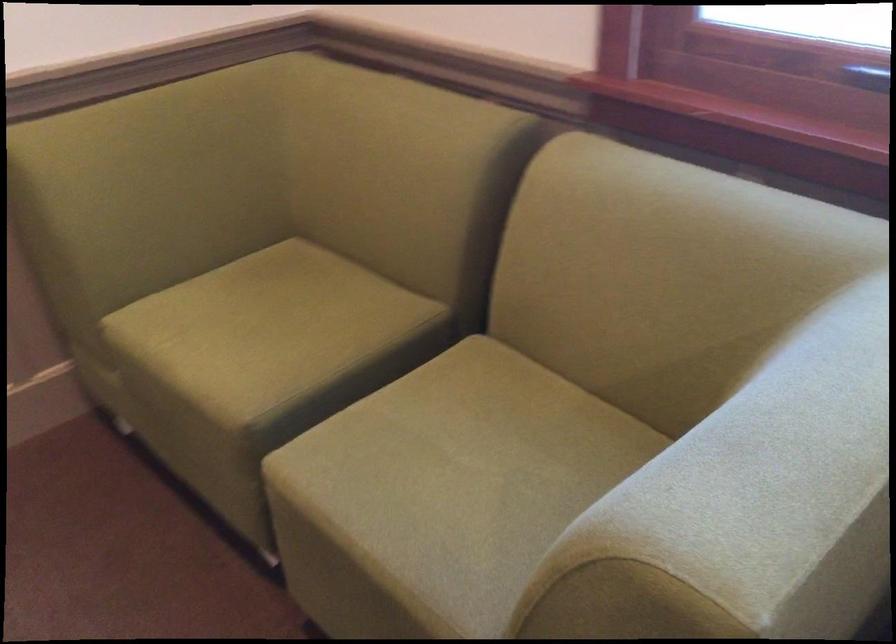
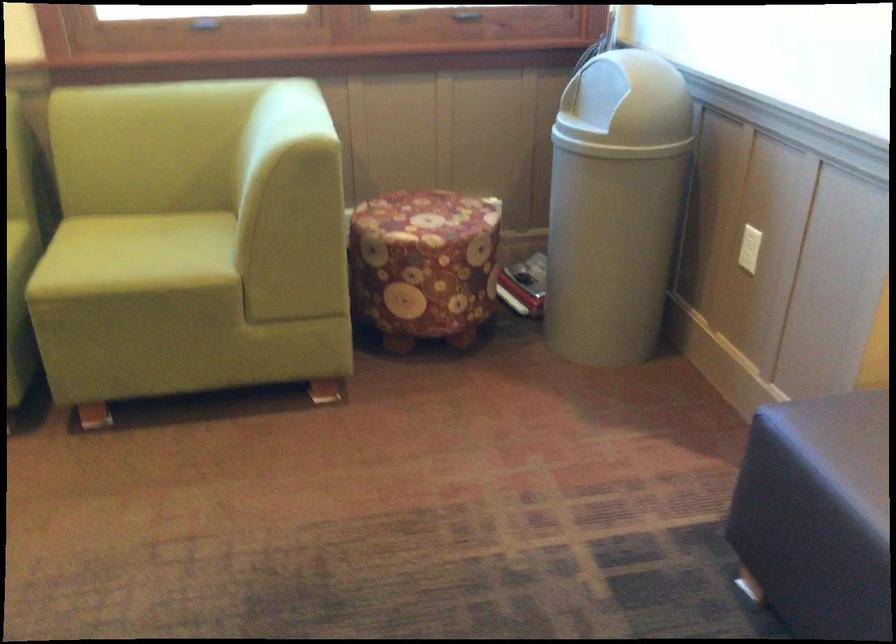
Where in the second image is the point corresponding to point (472, 465) from the first image?

(142, 252)